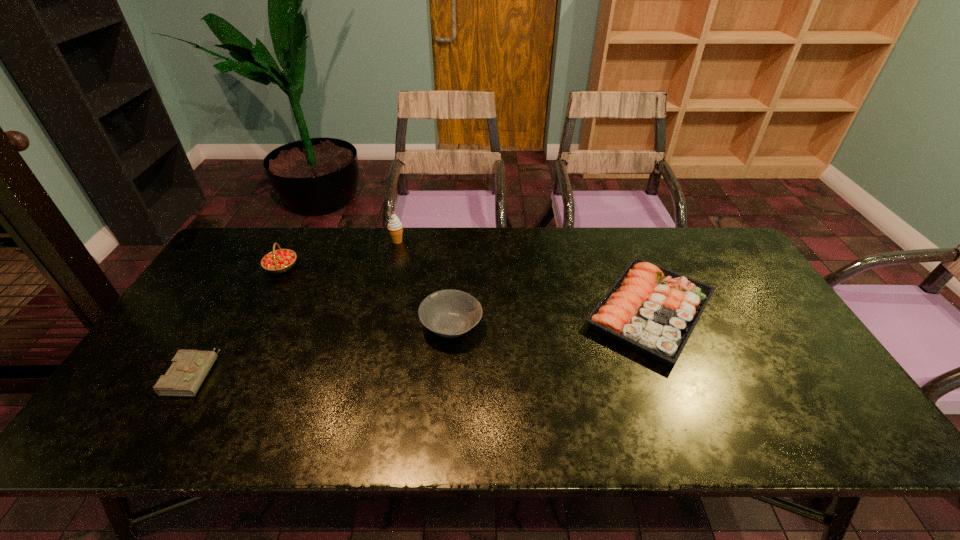
This screenshot has height=540, width=960. Identify the location of object that is at the far right corner. (651, 309).

You are a GUI agent. You are given a task and a screenshot of the screen. Output one action in this format:
    pyautogui.click(x=<x>, y=<y>)
    Task: Click on the free space at the far edge of the desktop
    The image size is (960, 540).
    Given the screenshot: What is the action you would take?
    pyautogui.click(x=522, y=272)

In the image, there is a desktop. Find the location of `vacant space at the near edge`. vacant space at the near edge is located at coordinates (677, 423).

Identify the location of vacant region at the left edge of the desktop. This screenshot has height=540, width=960. coord(233,296).

At what (x,y) coordinates should I click in order to perform the action: click on vacant region at the right edge of the desktop. Please return your answer as a coordinate pair (x, y). The image size is (960, 540). Looking at the image, I should click on (798, 355).

Where is `free space at the far left corner of the desktop`? free space at the far left corner of the desktop is located at coordinates tap(226, 254).

You are a GUI agent. You are given a task and a screenshot of the screen. Output one action in this format:
    pyautogui.click(x=<x>, y=<y>)
    Task: Click on the free space at the near left corner
    
    Given the screenshot: What is the action you would take?
    pyautogui.click(x=109, y=432)

At what (x,y) coordinates should I click in order to perform the action: click on vacant area that lies between the third object from left to right and the platter. Please return your answer as a coordinate pair (x, y). This screenshot has width=960, height=540. Looking at the image, I should click on (524, 276).

Identify the location of empty space that is in between the diary and the fourth shortest object. The width and height of the screenshot is (960, 540). (237, 320).

The width and height of the screenshot is (960, 540). What are the coordinates of `vacant area between the second object from right to left and the shortest object` in the screenshot? It's located at (323, 349).